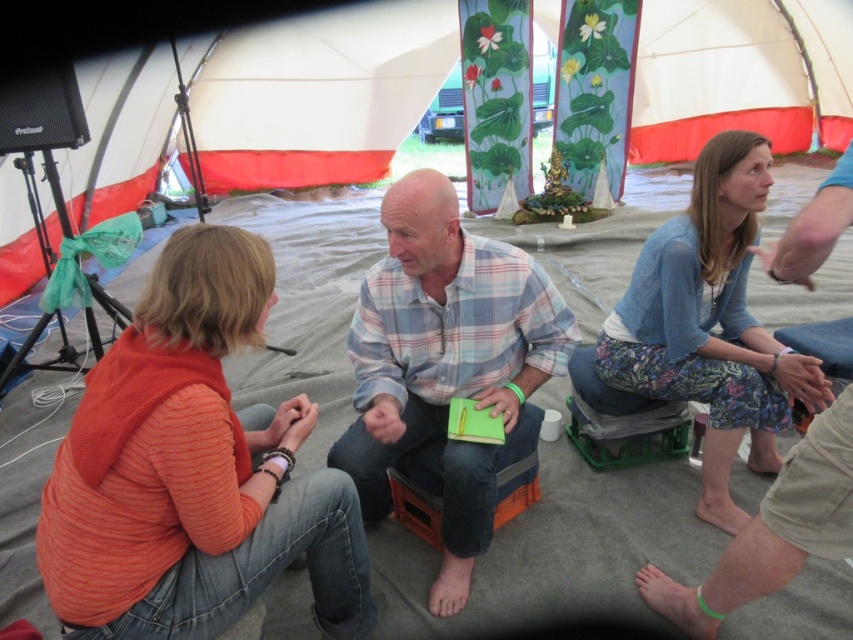
Question: Among these points, which one is nearest to the camera?

Choices:
 (A) (503, 330)
 (B) (709, 253)
 (C) (338, 538)

Answer: (C)

Question: Where is orange sweater at lower left located in relation to blue knitted sweater at upper right in the image?

Choices:
 (A) left
 (B) right

Answer: (A)

Question: Is orange sweater at lower left in front of plaid shirt at center?

Choices:
 (A) no
 (B) yes

Answer: (B)

Question: Which object is positioned farthest from the blue knitted sweater at upper right?

Choices:
 (A) plaid shirt at center
 (B) orange sweater at lower left

Answer: (B)

Question: Does orange sweater at lower left appear over plaid shirt at center?

Choices:
 (A) yes
 (B) no

Answer: (B)

Question: Which point is farther from the camera taking this photo?

Choices:
 (A) (688, 394)
 (B) (74, 573)
 (C) (408, 435)

Answer: (A)